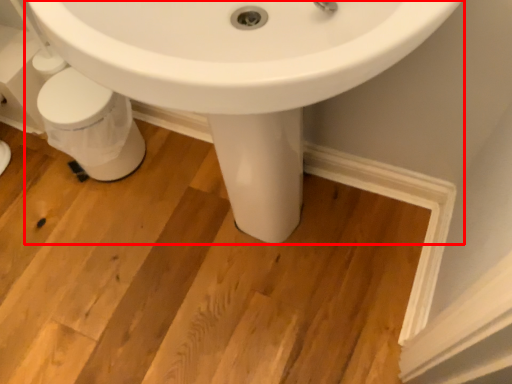
Question: Observing the image, what is the correct spatial positioning of sink (annotated by the red box) in reference to porcelain?

Choices:
 (A) left
 (B) right

Answer: (B)